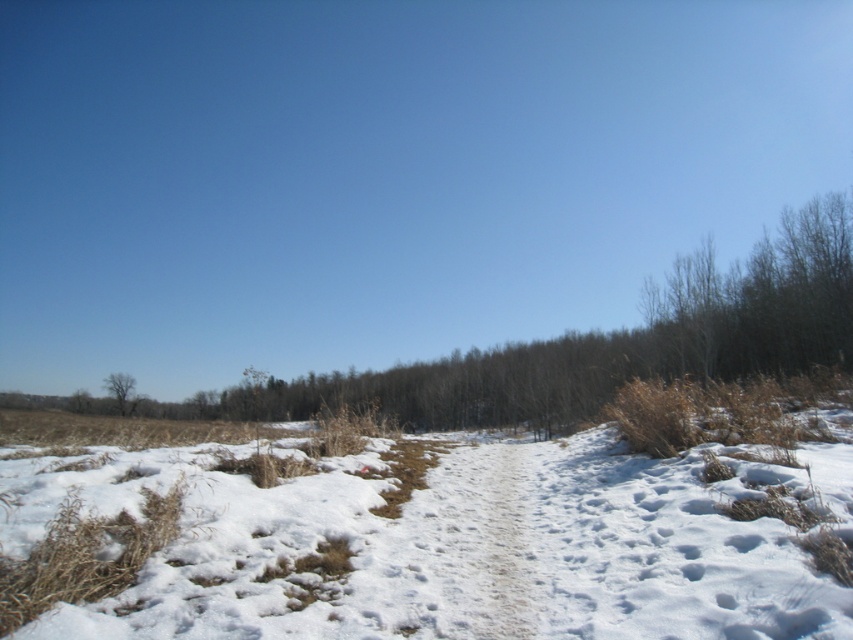
Question: Which of the following is the closest to the observer?

Choices:
 (A) brown rough tree at lower left
 (B) white fluffy snow at center

Answer: (B)

Question: Is white fluffy snow at center behind brown rough tree at lower left?

Choices:
 (A) yes
 (B) no

Answer: (B)

Question: Which of the following is the closest to the observer?

Choices:
 (A) (109, 378)
 (B) (625, 529)

Answer: (B)

Question: Which point is farther to the camera?

Choices:
 (A) white fluffy snow at center
 (B) brown rough tree at lower left

Answer: (B)

Question: Is white fluffy snow at center thinner than brown rough tree at lower left?

Choices:
 (A) no
 (B) yes

Answer: (B)

Question: Is white fluffy snow at center closer to camera compared to brown rough tree at lower left?

Choices:
 (A) yes
 (B) no

Answer: (A)